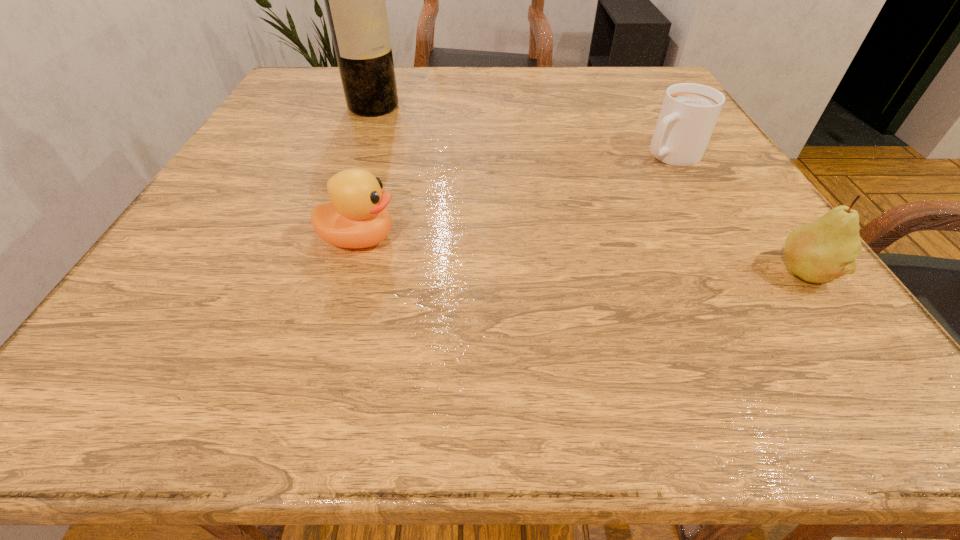
This screenshot has width=960, height=540. Find the location of `free point located 0.270m on the front-facing side of the farthest object`. free point located 0.270m on the front-facing side of the farthest object is located at coordinates (452, 168).

You are a GUI agent. You are given a task and a screenshot of the screen. Output one action in this format:
    pyautogui.click(x=<x>, y=<y>)
    Task: Click on the blank area located on the front-facing side of the farthest object
    
    Given the screenshot: What is the action you would take?
    pyautogui.click(x=449, y=166)

You are a GUI agent. You are given a task and a screenshot of the screen. Output one action in this format:
    pyautogui.click(x=<x>, y=<y>)
    Task: Click on the vacant space located on the front-facing side of the farthest object
    The width and height of the screenshot is (960, 540).
    Given the screenshot: What is the action you would take?
    pyautogui.click(x=415, y=139)

You are a GUI agent. You are given a task and a screenshot of the screen. Output one action in this format:
    pyautogui.click(x=<x>, y=<y>)
    Task: Click on the object that is at the far edge
    
    Given the screenshot: What is the action you would take?
    pyautogui.click(x=355, y=3)

You are a GUI agent. You are given a task and a screenshot of the screen. Output one action in this format:
    pyautogui.click(x=<x>, y=<y>)
    Task: Click on the object that is at the near edge
    The width and height of the screenshot is (960, 540).
    Given the screenshot: What is the action you would take?
    pyautogui.click(x=822, y=251)

Locate an element on the screen. The width and height of the screenshot is (960, 540). pear that is at the right edge is located at coordinates (822, 251).

The width and height of the screenshot is (960, 540). In order to click on cappuccino present at the right edge in this screenshot , I will do `click(689, 112)`.

What are the coordinates of `object that is at the near right corner` in the screenshot? It's located at (822, 251).

This screenshot has height=540, width=960. What are the coordinates of `vacant space at the far edge` in the screenshot? It's located at (592, 96).

You are a GUI agent. You are given a task and a screenshot of the screen. Output one action in this format:
    pyautogui.click(x=<x>, y=<y>)
    Task: Click on the vacant region at the near edge of the desktop
    The image size is (960, 540).
    Given the screenshot: What is the action you would take?
    pyautogui.click(x=366, y=326)